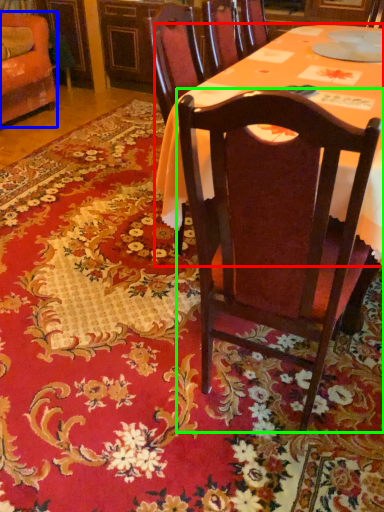
Question: Which is farther away from desk (highlighted by a red box)? chair (highlighted by a blue box) or chair (highlighted by a green box)?

Choices:
 (A) chair
 (B) chair

Answer: (A)